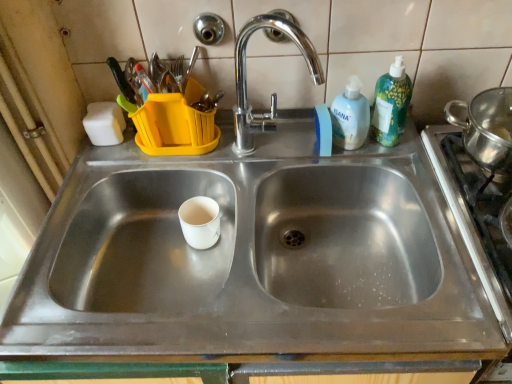
Where is `vacant space in front of green plastic bottle at upper right, positioned as the second cleaning product in left-to-right order`? vacant space in front of green plastic bottle at upper right, positioned as the second cleaning product in left-to-right order is located at coordinates (409, 172).